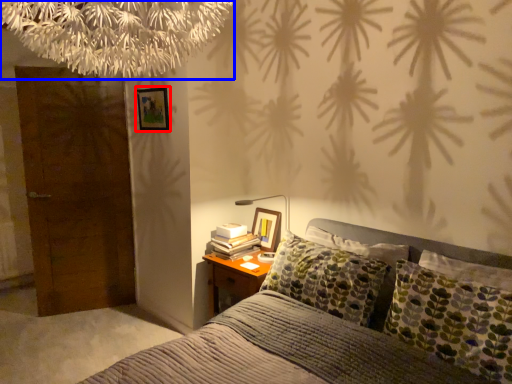
Question: Which object appears farthest to the camera in this image, picture frame (highlighted by a red box) or tree (highlighted by a blue box)?

Choices:
 (A) picture frame
 (B) tree

Answer: (A)